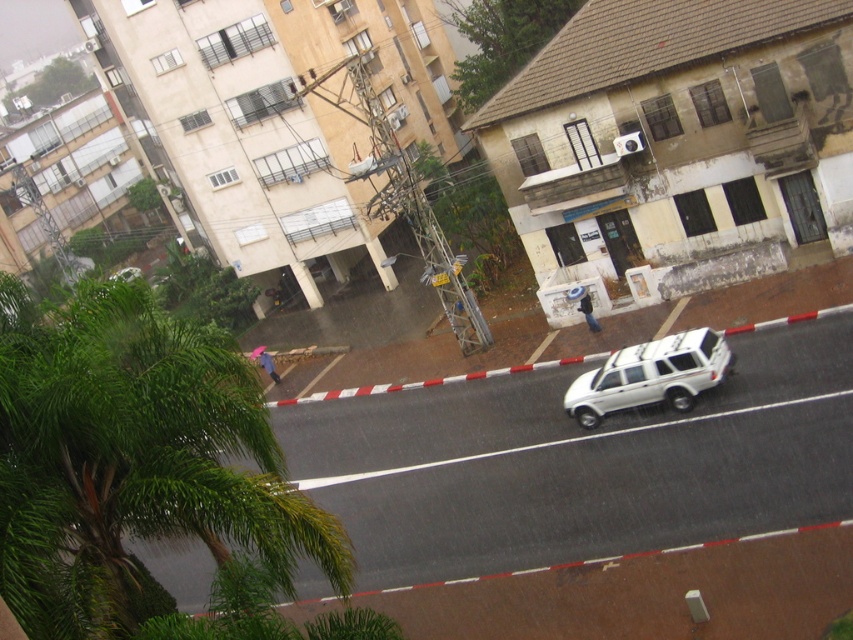
Does point (122, 582) come in front of point (641, 344)?

Yes, point (122, 582) is closer to viewer.

Which is behind, point (184, 342) or point (711, 340)?

The point (711, 340) is more distant.

Locate an element on the screen. The height and width of the screenshot is (640, 853). green leafy palm tree at lower left is located at coordinates (132, 460).

Between white matte suv at center and green leafy palm tree at lower left, which one appears on the left side from the viewer's perspective?

Positioned to the left is green leafy palm tree at lower left.

Which of these two, white matte suv at center or green leafy palm tree at lower left, stands taller?

white matte suv at center

Locate an element on the screen. The width and height of the screenshot is (853, 640). white matte suv at center is located at coordinates (579, 464).

Image resolution: width=853 pixels, height=640 pixels. I want to click on white matte suv at center, so click(579, 464).

Does white matte suv at center appear on the left side of white matte suv at center-right?

Correct, you'll find white matte suv at center to the left of white matte suv at center-right.

Can you confirm if white matte suv at center is taller than white matte suv at center-right?

Correct, white matte suv at center is much taller as white matte suv at center-right.

Is point (840, 349) in front of point (572, 401)?

Yes, it is in front of point (572, 401).

Image resolution: width=853 pixels, height=640 pixels. I want to click on white matte suv at center, so click(579, 464).